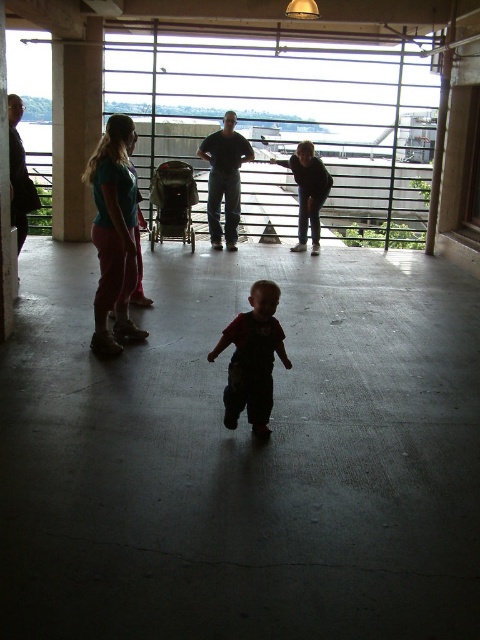
The scene shows a child in dark red overalls at center and adults near a railing in the background. If the child moves directly towards the railing, will they pass through the area marked by point (252, 358)?

Yes, the dark red overalls at center is represented by point (252, 358), so the child will pass through that point on their way to the railing.

You are a parent trying to locate your child in the garage. You see the dark red overalls at center and the green fabric stroller at center. Which object is positioned to the right side?

The dark red overalls at center is to the right of the green fabric stroller at center.

You are a parent trying to decide which item to carry first between the dark red overalls at center and the green fabric stroller at center. Based on their sizes, which one is easier to carry?

The dark red overalls at center has a smaller size compared to the green fabric stroller at center, so it is easier to carry the dark red overalls at center.